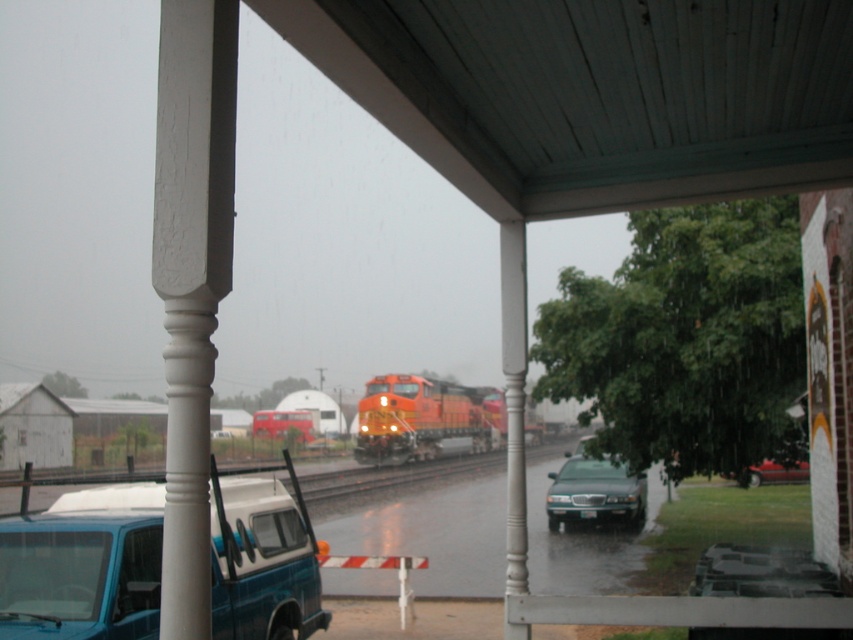
Question: Which object appears closest to the camera in this image?

Choices:
 (A) teal matte van at lower left
 (B) green matte sedan at center

Answer: (A)

Question: Is orange glossy locomotive at center above metallic red car at lower right?

Choices:
 (A) yes
 (B) no

Answer: (B)

Question: Which of the following is the closest to the observer?

Choices:
 (A) glossy asphalt flood at lower center
 (B) orange glossy locomotive at center
 (C) green matte sedan at center
 (D) teal matte van at lower left

Answer: (A)

Question: Estimate the real-world distances between objects in this image. Which object is farther from the teal matte van at lower left?

Choices:
 (A) green matte sedan at center
 (B) metallic red car at lower right

Answer: (A)

Question: Does orange glossy locomotive at center have a smaller size compared to green matte sedan at center?

Choices:
 (A) yes
 (B) no

Answer: (B)

Question: Does glossy asphalt flood at lower center appear over metallic red car at lower right?

Choices:
 (A) yes
 (B) no

Answer: (B)